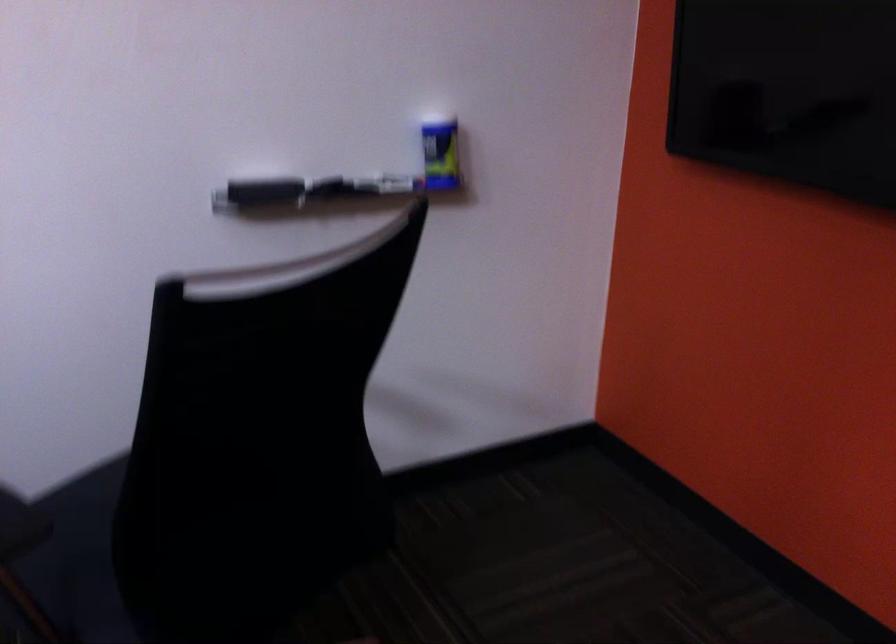
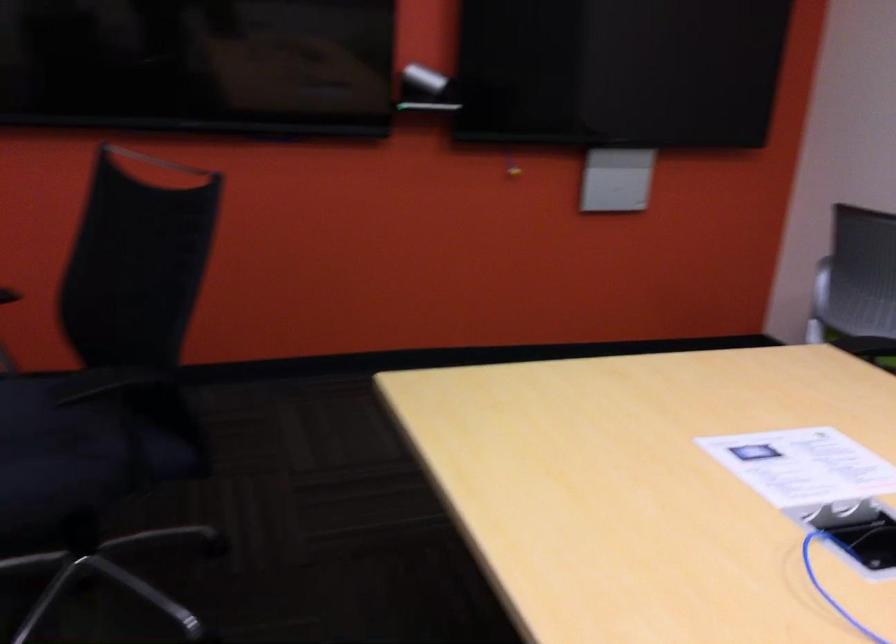
Find the pixel in the second image that matches (x=73, y=574) in the first image.

(82, 450)